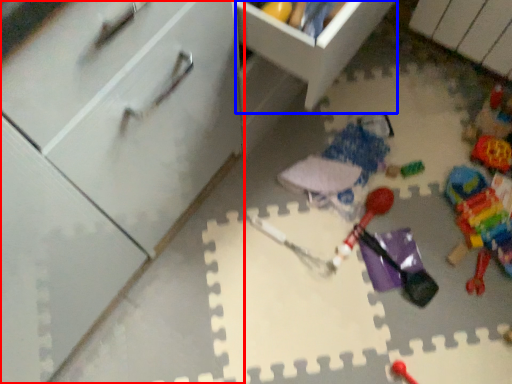
Question: Which of the following is the farthest to the observer, cabinetry (highlighted by a red box) or cabinetry (highlighted by a blue box)?

Choices:
 (A) cabinetry
 (B) cabinetry

Answer: (B)